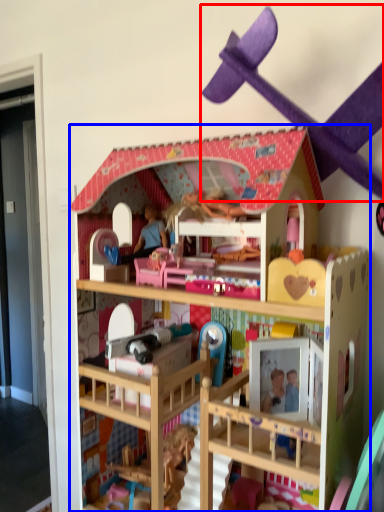
Question: Which object is closer to the camera taking this photo, toy (highlighted by a red box) or toy (highlighted by a blue box)?

Choices:
 (A) toy
 (B) toy

Answer: (A)